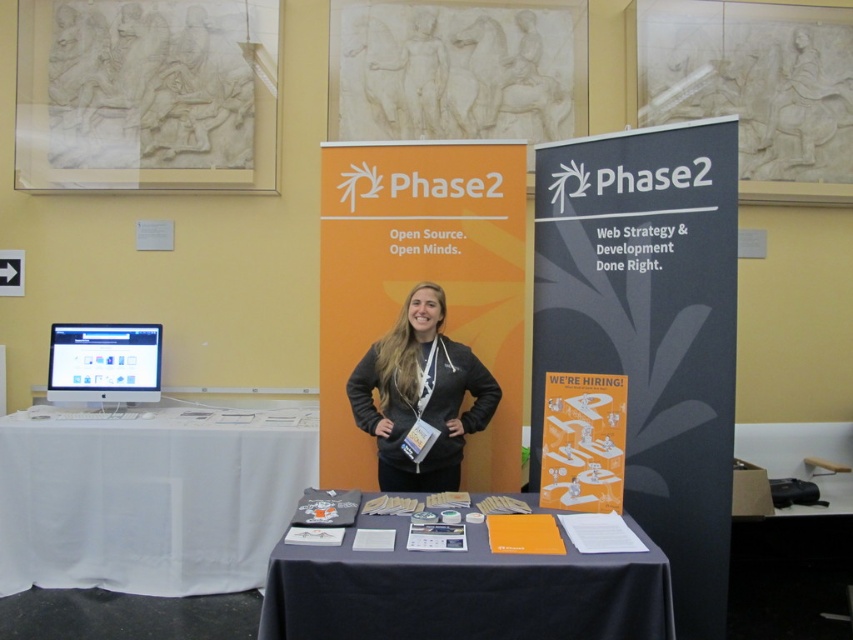
Question: Which object is closer to the camera taking this photo?

Choices:
 (A) orange paper at center
 (B) dark gray fleece jacket at center
 (C) matte silver monitor at left

Answer: (A)

Question: Can you confirm if orange paper at center is positioned above matte silver monitor at left?

Choices:
 (A) no
 (B) yes

Answer: (A)

Question: Based on their relative distances, which object is farther from the matte silver monitor at left?

Choices:
 (A) orange paper at center
 (B) dark gray fleece jacket at center
 (C) white cloth-covered table at lower left

Answer: (A)

Question: Does white cloth-covered table at lower left have a lesser width compared to dark gray fleece jacket at center?

Choices:
 (A) yes
 (B) no

Answer: (B)

Question: Can you confirm if orange paper at center is wider than matte silver monitor at left?

Choices:
 (A) no
 (B) yes

Answer: (B)

Question: Which of the following is the closest to the observer?

Choices:
 (A) (457, 342)
 (B) (637, 621)

Answer: (B)